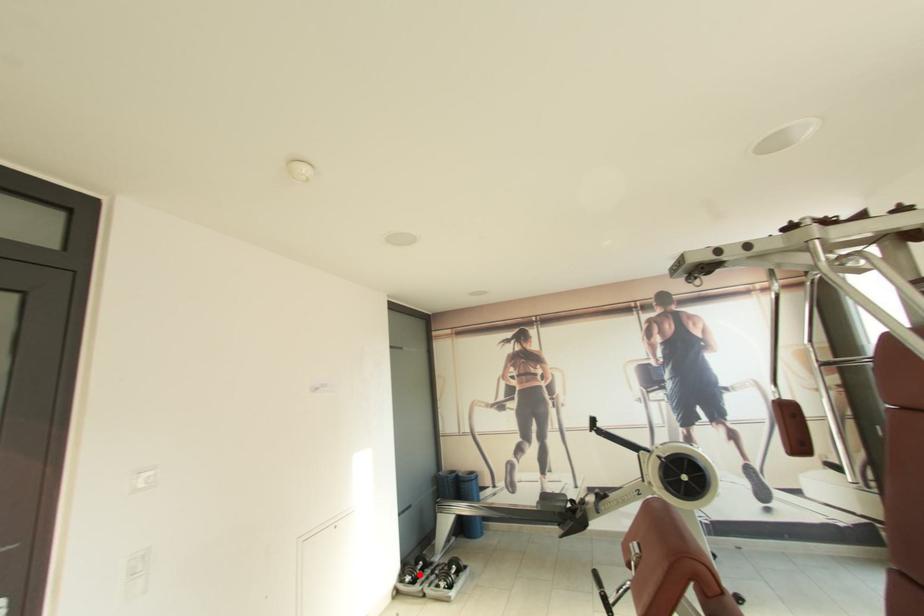
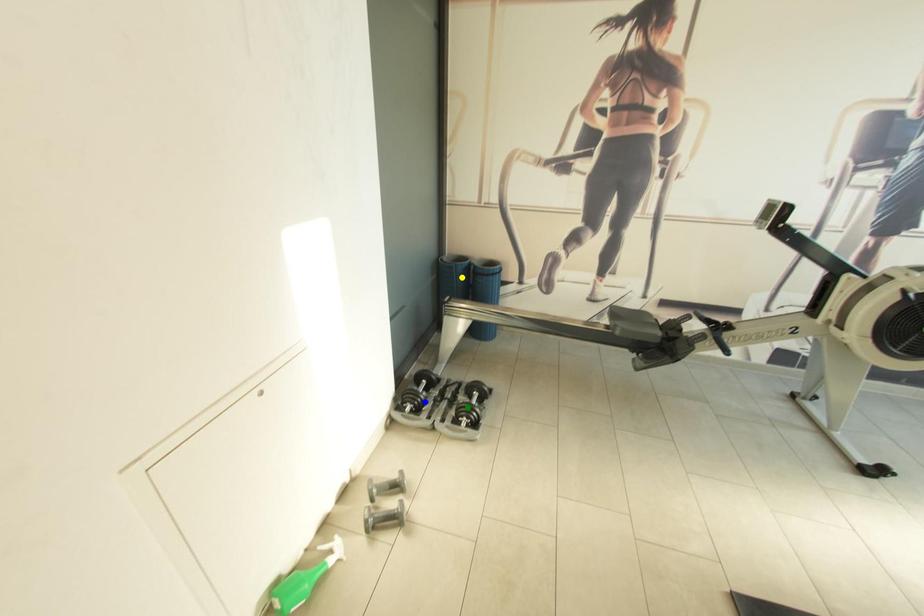
Question: I am providing you with two images of the same scene from different viewpoints. A red point is marked on the first image. You are given multiple points on the second image. Which mark in image 2 goes with the point in image 1?

Choices:
 (A) blue point
 (B) green point
 (C) yellow point

Answer: (A)